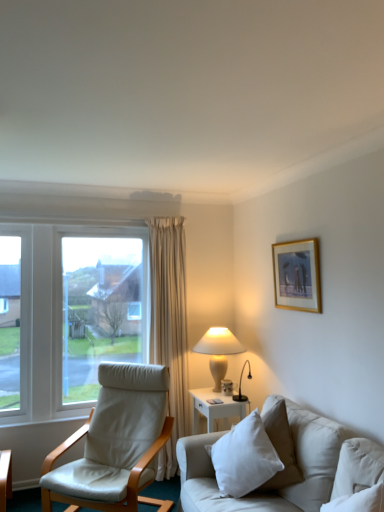
Question: Is gold-framed artwork at upper right positioned far away from white fabric couch at lower right?

Choices:
 (A) no
 (B) yes

Answer: (A)

Question: Can you confirm if gold-framed artwork at upper right is taller than white fabric couch at lower right?

Choices:
 (A) no
 (B) yes

Answer: (A)

Question: Is gold-framed artwork at upper right aimed at white fabric couch at lower right?

Choices:
 (A) yes
 (B) no

Answer: (B)

Question: Is gold-framed artwork at upper right not inside white fabric couch at lower right?

Choices:
 (A) no
 (B) yes

Answer: (B)

Question: Can you confirm if gold-framed artwork at upper right is positioned to the right of white fabric couch at lower right?

Choices:
 (A) yes
 (B) no

Answer: (A)

Question: In the image, is gold-framed artwork at upper right on the left side or the right side of white soft pillow at lower right, positioned as the 2th pillow in back-to-front order?

Choices:
 (A) right
 (B) left

Answer: (B)

Question: From the image's perspective, is gold-framed artwork at upper right positioned above or below white soft pillow at lower right, the 1th pillow positioned from the front?

Choices:
 (A) above
 (B) below

Answer: (A)

Question: Relative to white soft pillow at lower right, which is the 1th pillow from right to left, is gold-framed artwork at upper right in front or behind?

Choices:
 (A) front
 (B) behind

Answer: (B)

Question: Looking at their shapes, would you say gold-framed artwork at upper right is wider or thinner than white soft pillow at lower right, positioned as the 2th pillow in back-to-front order?

Choices:
 (A) thin
 (B) wide

Answer: (A)

Question: Do you think white soft pillow at lower right, positioned as the 2th pillow in back-to-front order, is within white leather chair at left, or outside of it?

Choices:
 (A) inside
 (B) outside

Answer: (B)

Question: In terms of width, does white soft pillow at lower right, the 1th pillow positioned from the front, look wider or thinner when compared to white leather chair at left?

Choices:
 (A) wide
 (B) thin

Answer: (B)

Question: In terms of size, does white soft pillow at lower right, positioned as the 2th pillow in back-to-front order, appear bigger or smaller than white leather chair at left?

Choices:
 (A) small
 (B) big

Answer: (A)

Question: Considering the positions of point (354, 477) and point (72, 488), is point (354, 477) closer or farther from the camera than point (72, 488)?

Choices:
 (A) farther
 (B) closer

Answer: (B)

Question: From a real-world perspective, is white cotton pillow at lower right, the 2th pillow viewed from the front, physically located above or below white ceramic table lamp at center-right?

Choices:
 (A) above
 (B) below

Answer: (B)

Question: Visually, is white cotton pillow at lower right, the 1th pillow from the back, positioned to the left or to the right of white ceramic table lamp at center-right?

Choices:
 (A) left
 (B) right

Answer: (B)